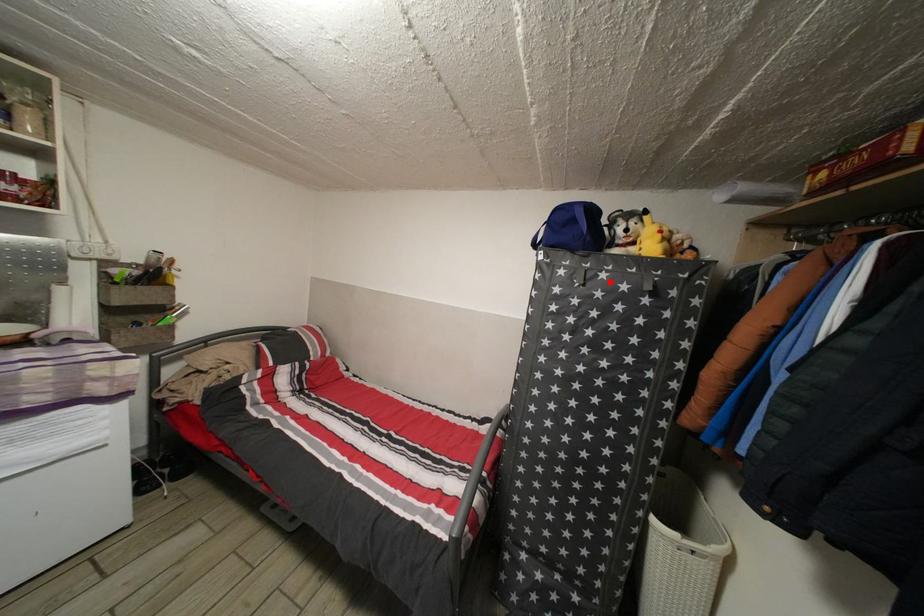
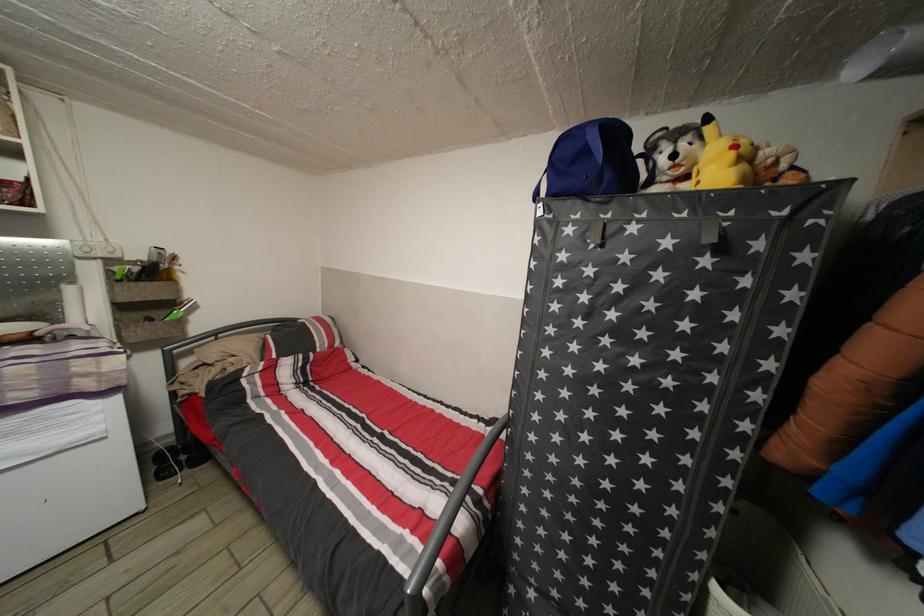
In the second image, find the point that corresponds to the highlighted location in the first image.

(639, 235)